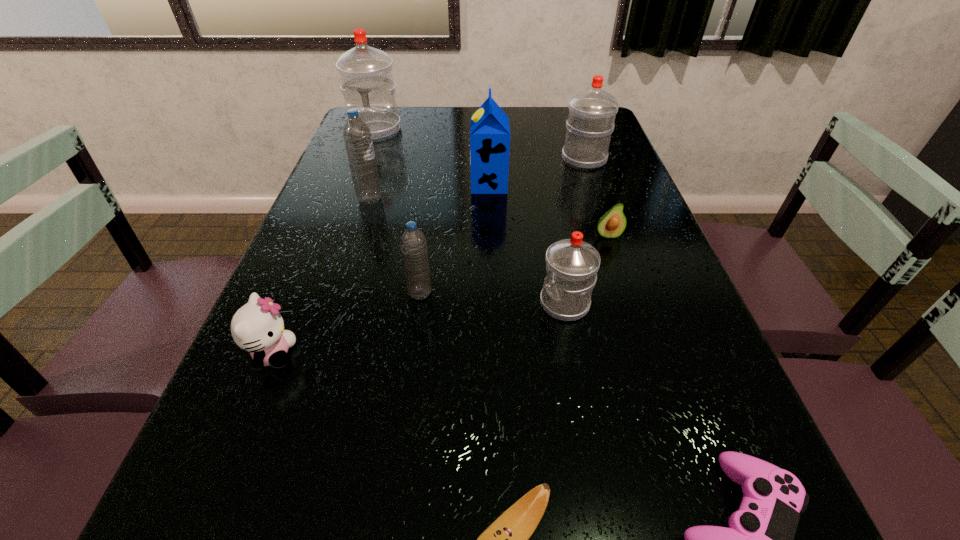
Image resolution: width=960 pixels, height=540 pixels. Find the location of `kitten that is at the left edge`. kitten that is at the left edge is located at coordinates (257, 327).

Locate an element on the screen. water bottle located at the right edge is located at coordinates [x=591, y=117].

In order to click on avocado situated at the right edge in this screenshot , I will do `click(612, 224)`.

The image size is (960, 540). Identify the location of object present at the far left corner. (366, 75).

Find the location of a particular element. The image size is (960, 540). vacant space at the far edge is located at coordinates (451, 129).

The height and width of the screenshot is (540, 960). In the image, there is a desktop. What are the coordinates of `free region at the left edge` in the screenshot? It's located at (345, 264).

Where is `blank area at the right edge`? The image size is (960, 540). blank area at the right edge is located at coordinates (608, 178).

Where is `empty location between the smaller blue water bottle and the farthest white water bottle`? empty location between the smaller blue water bottle and the farthest white water bottle is located at coordinates (397, 212).

Locate an element on the screen. Image resolution: width=960 pixels, height=540 pixels. free space between the smallest white water bottle and the fourth nearest water bottle is located at coordinates (574, 232).

Where is `free space between the carton and the smallest white water bottle`? The image size is (960, 540). free space between the carton and the smallest white water bottle is located at coordinates (527, 244).